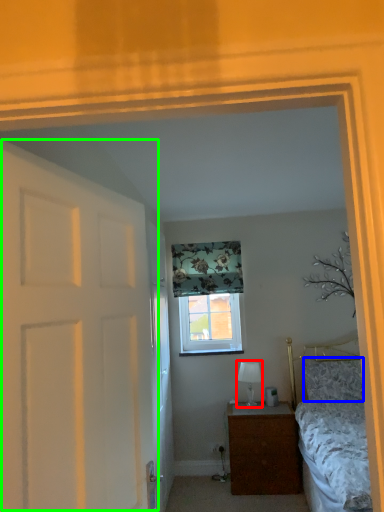
Question: Considering the real-world distances, which object is farthest from table lamp (highlighted by a red box)? pillow (highlighted by a blue box) or door (highlighted by a green box)?

Choices:
 (A) pillow
 (B) door

Answer: (B)